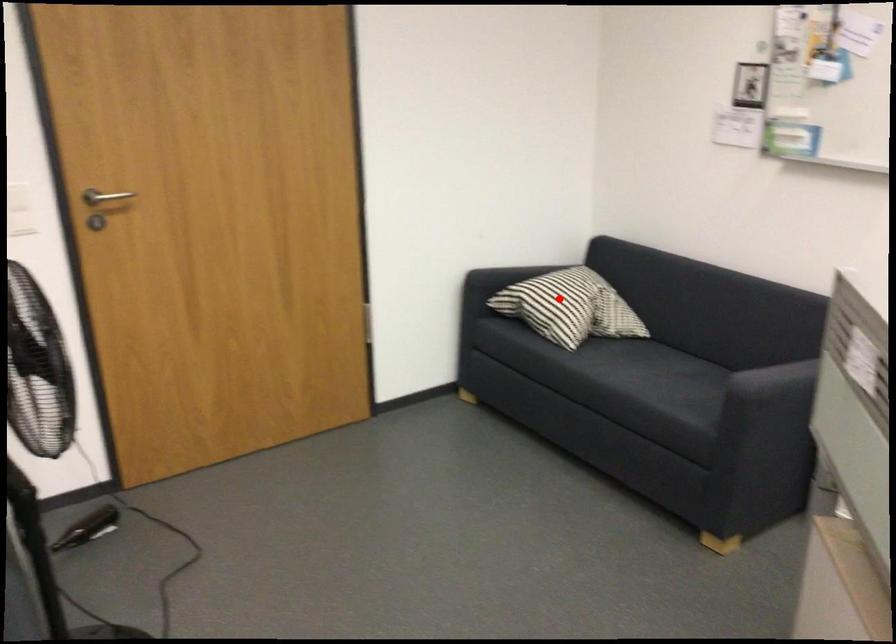
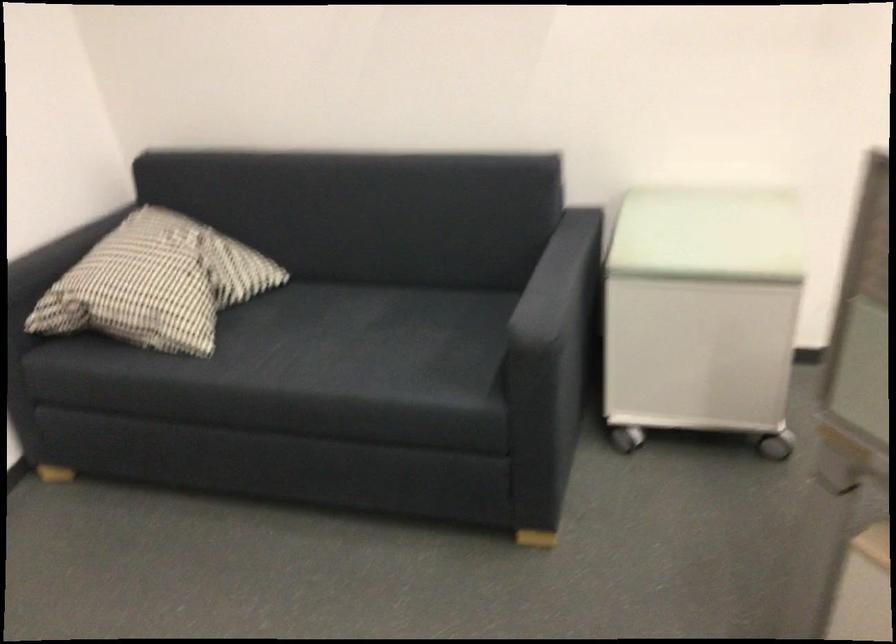
Question: I am providing you with two images of the same scene from different viewpoints. Image1 has a red point marked. In image2, the corresponding 3D location appears at what relative position? Reply with the corresponding letter.

Choices:
 (A) Closer
 (B) Farther

Answer: (A)